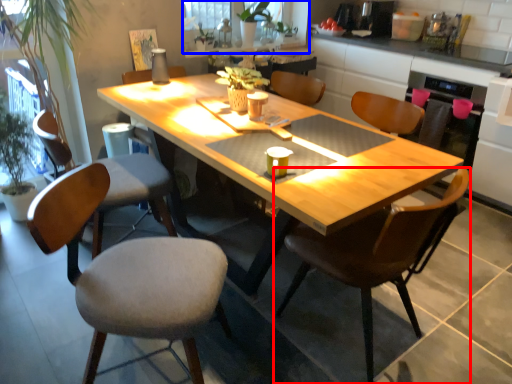
Question: Which point is closer to the camera, chair (highlighted by a red box) or window screen (highlighted by a blue box)?

Choices:
 (A) chair
 (B) window screen

Answer: (A)